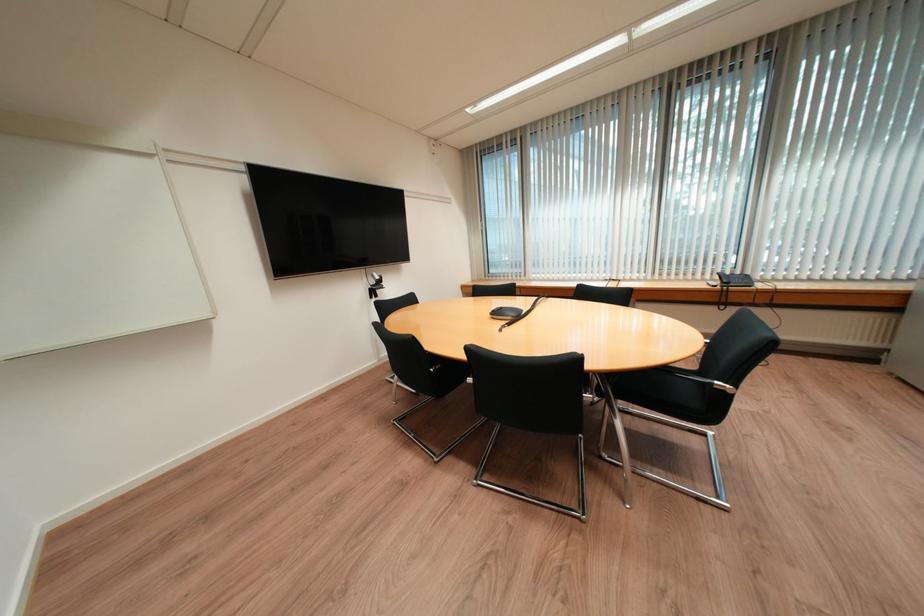
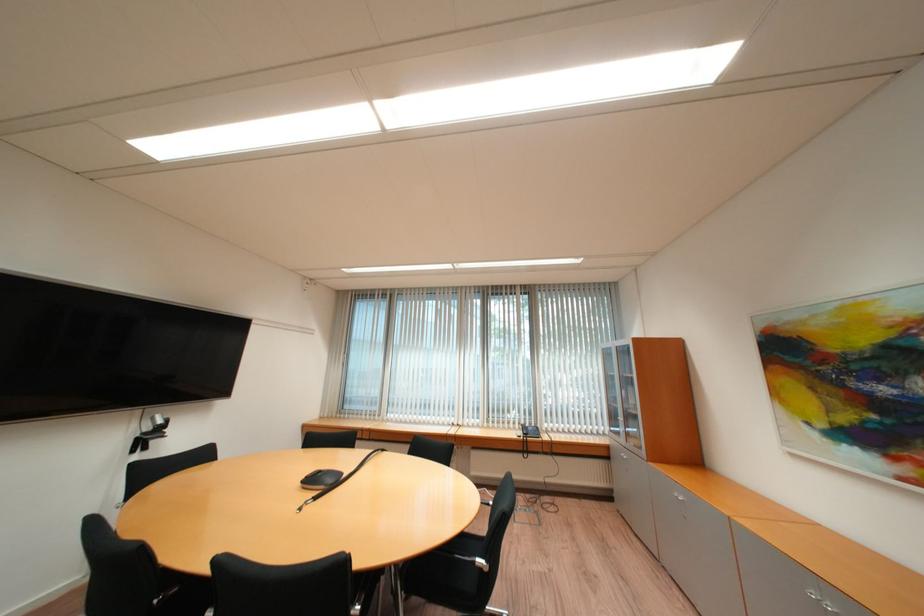
In the second image, find the point that corresponds to [382,277] in the first image.

(162, 419)